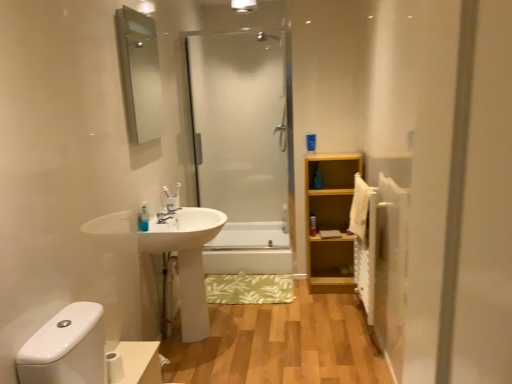
I want to click on vacant space that is in between light wood shelf at right and white textured radiator at right, so click(x=339, y=307).